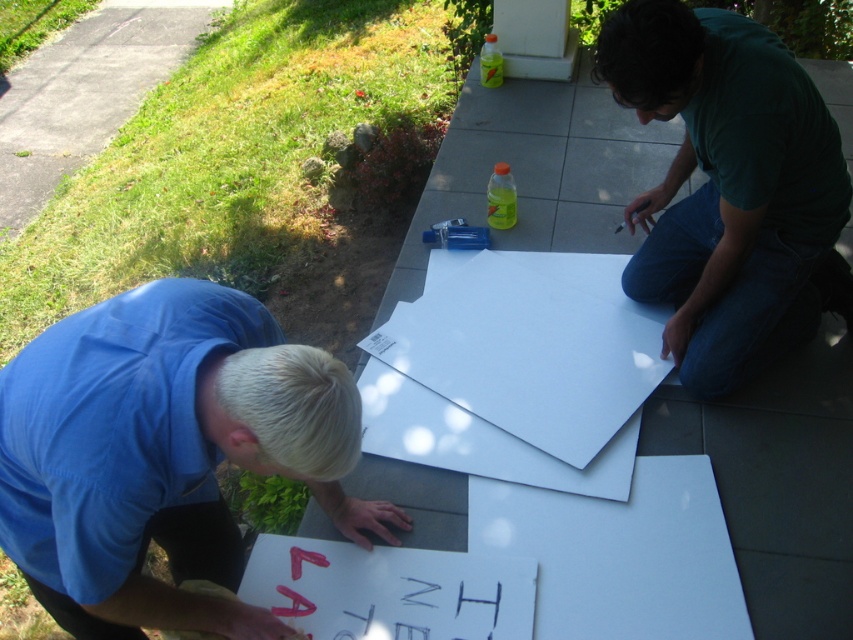
Can you confirm if white paper at lower left is positioned below white matte paper at center?

Yes.

Which is above, white paper at lower left or white matte paper at center?

Positioned higher is white matte paper at center.

Measure the distance between white paper at lower left and camera.

white paper at lower left and camera are 3.65 feet apart from each other.

You are a GUI agent. You are given a task and a screenshot of the screen. Output one action in this format:
    pyautogui.click(x=<x>, y=<y>)
    Task: Click on the white paper at lower left
    
    Given the screenshot: What is the action you would take?
    pyautogui.click(x=164, y=452)

Can you confirm if dark green t-shirt at upper right is bigger than white matte paper at center?

Yes, dark green t-shirt at upper right is bigger than white matte paper at center.

Does point (701, 289) come in front of point (546, 352)?

Yes, it is.

Who is more forward, (x=686, y=385) or (x=648, y=317)?

Point (x=686, y=385)

Find the location of a particular element. dark green t-shirt at upper right is located at coordinates (727, 186).

Is the position of white paper at lower left more distant than that of dark green t-shirt at upper right?

That is False.

Does point (221, 620) lie in front of point (683, 349)?

That is True.

Image resolution: width=853 pixels, height=640 pixels. What are the coordinates of `white paper at lower left` in the screenshot? It's located at (164, 452).